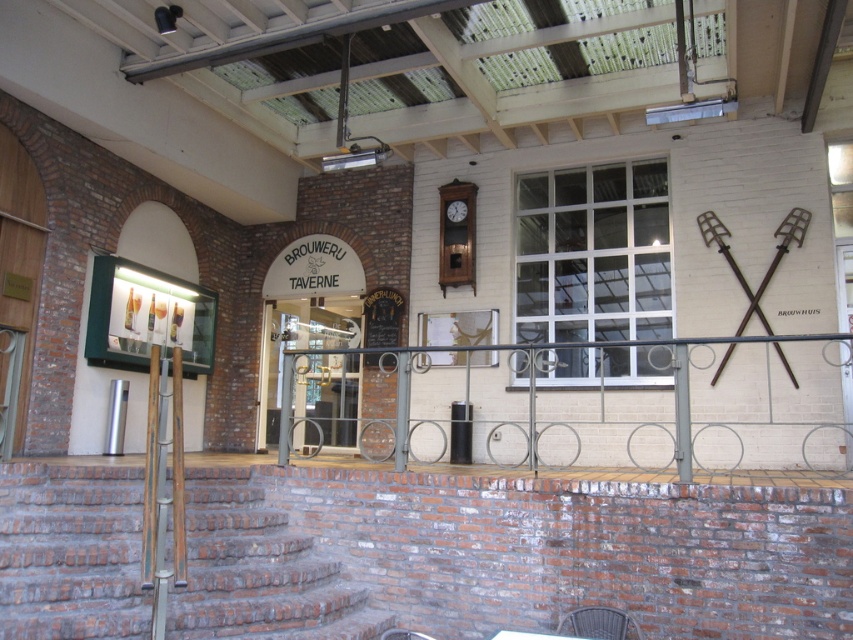
Consider the image. Who is lower down, brick stairs at lower center or wooden table at lower center?

Positioned lower is wooden table at lower center.

Does brick stairs at lower center have a greater height compared to wooden table at lower center?

Yes, brick stairs at lower center is taller than wooden table at lower center.

Measure the distance between point (300, 536) and camera.

The distance of point (300, 536) from camera is 5.73 meters.

The width and height of the screenshot is (853, 640). Identify the location of brick stairs at lower center. (70, 552).

Is brick stairs at lower center shorter than wooden clock at center?

Yes, brick stairs at lower center is shorter than wooden clock at center.

Is brick stairs at lower center positioned behind wooden clock at center?

No, brick stairs at lower center is closer to the viewer.

Is point (331, 600) in front of point (474, 188)?

Yes, it is.

Find the location of a particular element. Image resolution: width=853 pixels, height=640 pixels. brick stairs at lower center is located at coordinates (70, 552).

What do you see at coordinates (70, 552) in the screenshot? Image resolution: width=853 pixels, height=640 pixels. I see `brick stairs at lower center` at bounding box center [70, 552].

Is brick stairs at lower center shorter than rattan chair at lower center?

No, brick stairs at lower center is not shorter than rattan chair at lower center.

Which is behind, point (256, 620) or point (573, 625)?

The point (256, 620) is more distant.

Find the location of a particular element. This screenshot has width=853, height=640. brick stairs at lower center is located at coordinates (70, 552).